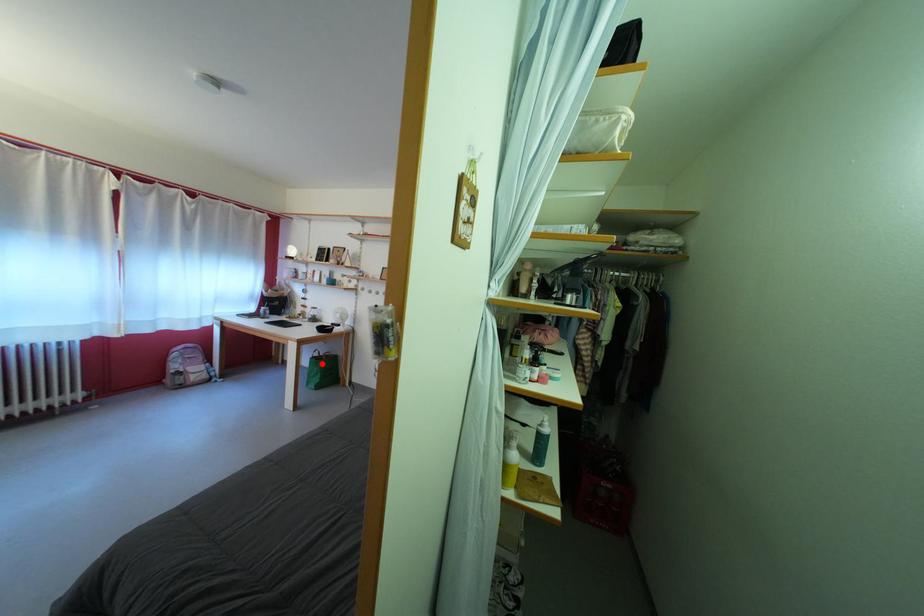
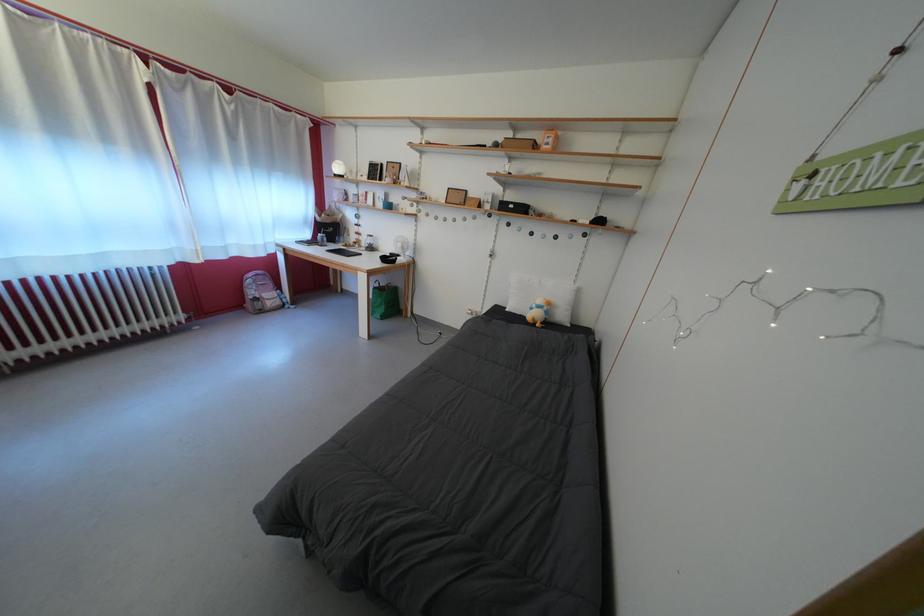
In the second image, find the point that corresponds to the highlighted location in the first image.

(383, 294)